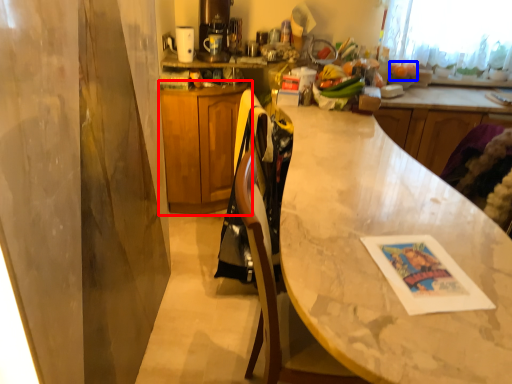
Question: Which of the following is the closest to the observer, cabinetry (highlighted by a red box) or fruit (highlighted by a blue box)?

Choices:
 (A) cabinetry
 (B) fruit

Answer: (A)